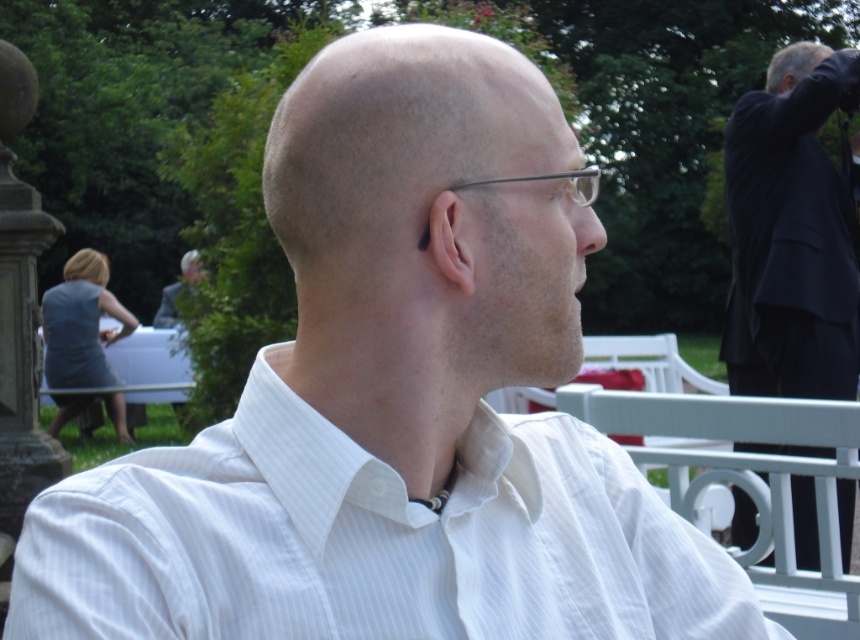
Is bald head at center to the right of matte white hair at upper center from the viewer's perspective?

Yes, bald head at center is to the right of matte white hair at upper center.

Which is behind, point (366, 243) or point (194, 282)?

Point (194, 282)

This screenshot has width=860, height=640. I want to click on bald head at center, so click(x=427, y=218).

Between dark suit at upper right and metallic wireframe glasses at center, which one appears on the left side from the viewer's perspective?

metallic wireframe glasses at center

Does dark suit at upper right have a greater width compared to metallic wireframe glasses at center?

In fact, dark suit at upper right might be narrower than metallic wireframe glasses at center.

You are a GUI agent. You are given a task and a screenshot of the screen. Output one action in this format:
    pyautogui.click(x=<x>, y=<y>)
    Task: Click on the dark suit at upper right
    The height and width of the screenshot is (640, 860).
    Given the screenshot: What is the action you would take?
    pyautogui.click(x=790, y=236)

Between white striped dress shirt at center and gray suit at upper left, which one is positioned lower?

white striped dress shirt at center

Does point (744, 604) come behind point (203, 269)?

No, (744, 604) is in front of (203, 269).

Who is more forward, [508,490] or [164,291]?

Point [508,490] is more forward.

This screenshot has width=860, height=640. What are the coordinates of `white striped dress shirt at center` in the screenshot? It's located at (369, 540).